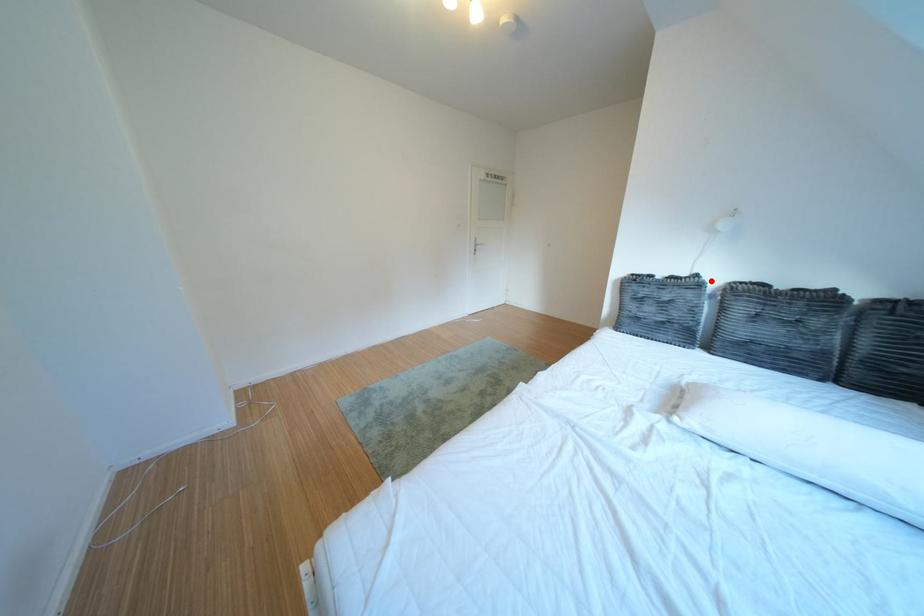
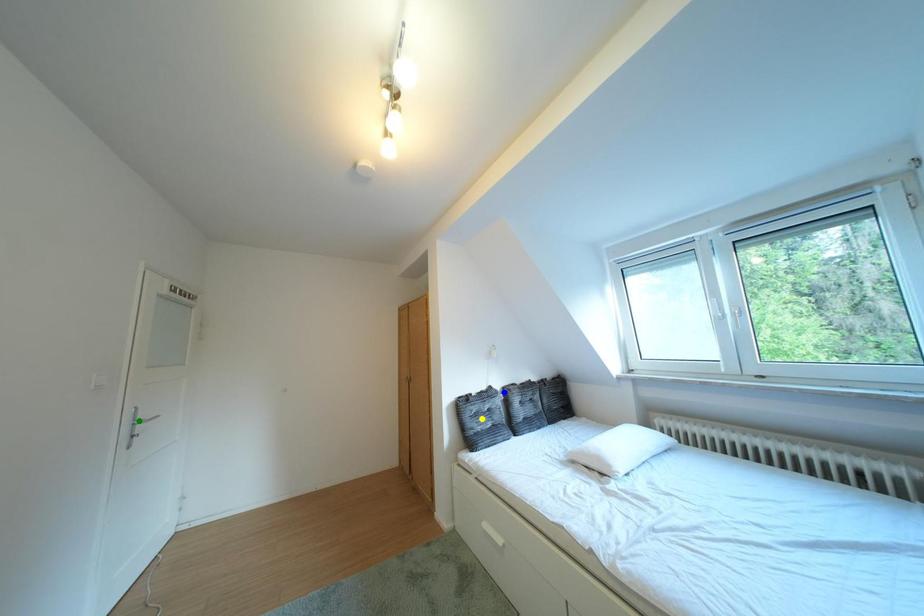
Question: I am providing you with two images of the same scene from different viewpoints. A red point is marked on the first image. You are given multiple points on the second image. Which point in image 2 represents the same 3d spot as the red point in image 1?

Choices:
 (A) blue point
 (B) green point
 (C) yellow point

Answer: (A)